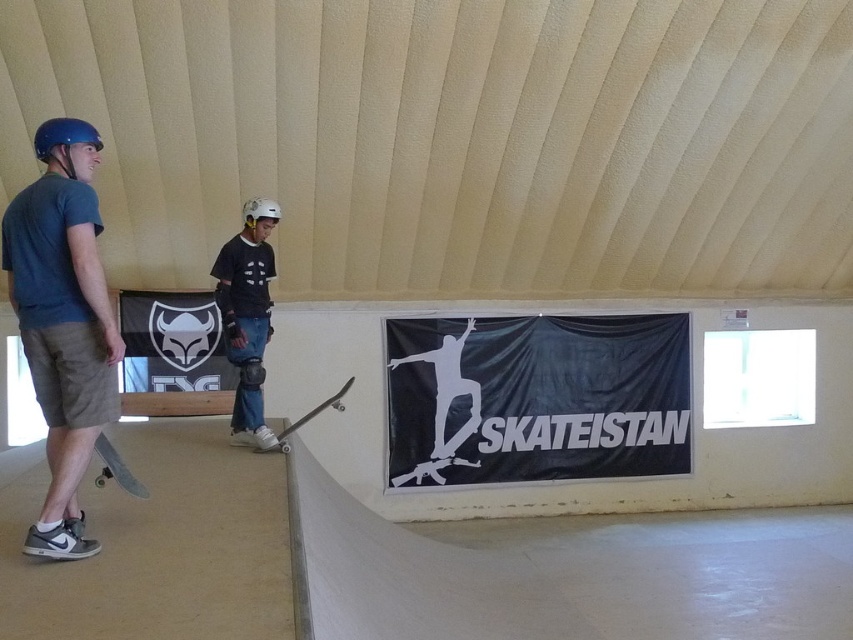
You are a photographer standing at the entrance of the skateboarding facility. You want to take a photo of the matte blue helmet at left and the wooden skateboard at center. Based on their positions, which object should you focus on first to ensure both are in frame?

The matte blue helmet at left is above the wooden skateboard at center, so you should focus on the wooden skateboard at center first to ensure both are in frame.

You are a skateboarder wanting to perform a trick on the white smooth ramp at center. However, you notice the wooden skateboard at lower left nearby. Considering their sizes, which object is more suitable for your trick?

The white smooth ramp at center is more suitable for performing a trick since it has a larger size compared to the wooden skateboard at lower left.

Based on the photo, you are a photographer setting up a tripod in the skateboarding facility. You want to capture both the matte blue helmet at left and the wooden skateboard at center in your shot. Which object will appear larger in the photo?

The matte blue helmet at left is taller than the wooden skateboard at center, so it will appear larger in the photo.